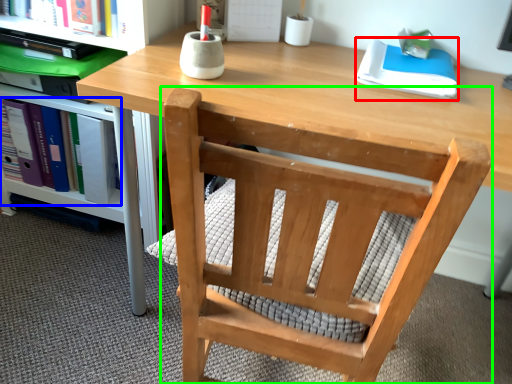
Question: Based on their relative distances, which object is nearer to paperback book (highlighted by a red box)? Choose from book (highlighted by a blue box) and chair (highlighted by a green box).

Choices:
 (A) book
 (B) chair

Answer: (B)